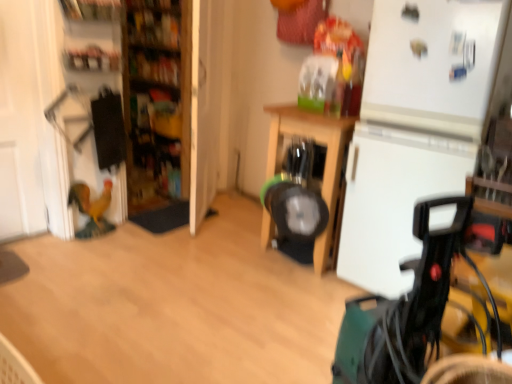
Locate an element on the screen. This screenshot has height=384, width=512. vacant area to the left of white matte refrigerator at right is located at coordinates (306, 303).